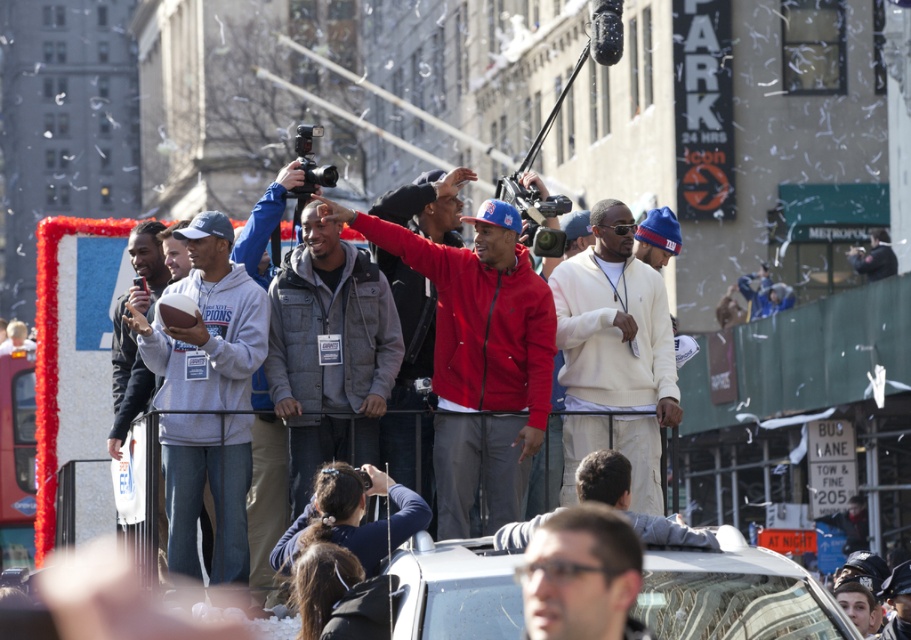
You are standing at the center of the scene and see a point marked at coordinates (479, 356). What object is located at that point?

The point at coordinates (479, 356) indicates the red matte jacket at center.

You are a photographer trying to capture a photo of the crowd. You notice two people in the foreground wearing a gray fleece sweatshirt at left and a dark gray jacket at center. Which person might block your view more if they turn sideways?

The gray fleece sweatshirt at left might block your view more than the dark gray jacket at center since it is wider.